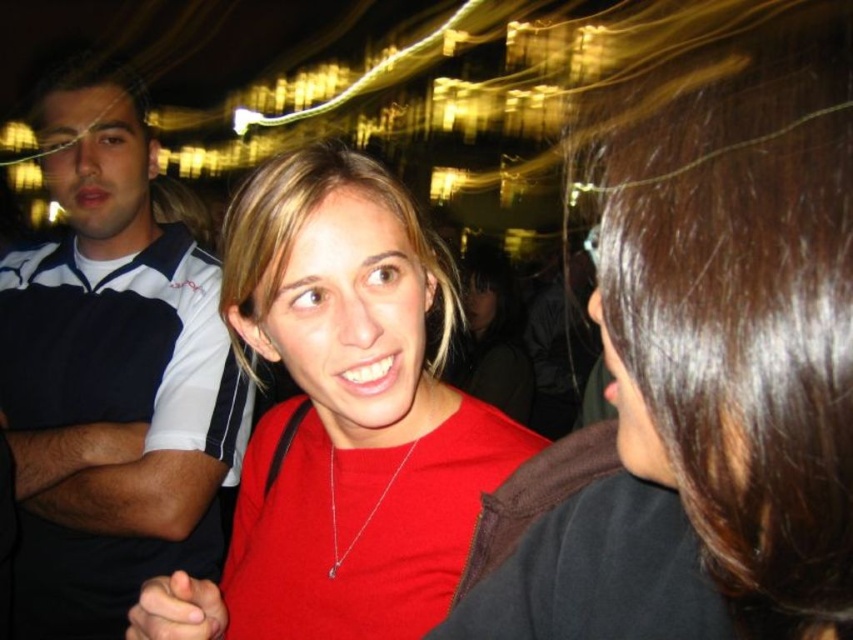
You are at a social event and want to approach the shiny brown hair at upper right. If you can walk at a normal pace of 3 feet per second, how many seconds will it take you to reach them?

The distance between you and the shiny brown hair at upper right is 67.70 feet. At a walking speed of 3 feet per second, it would take approximately 22.57 seconds to reach them.